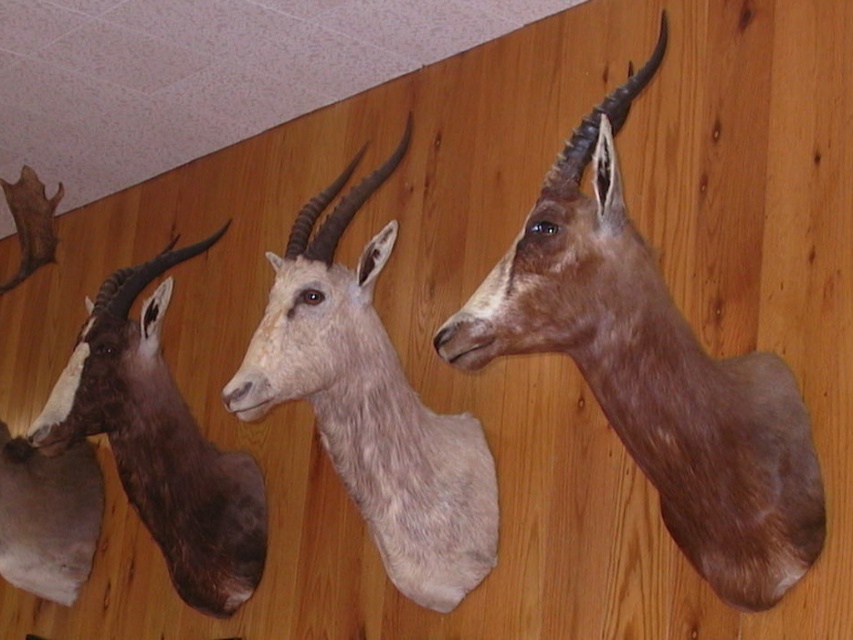
Who is more distant from viewer, (347, 209) or (264, 500)?

The point (264, 500) is behind.

Does white matte antelope head at center come in front of brown matte antelope at left?

Yes, it is in front of brown matte antelope at left.

Is point (462, 540) positioned in front of point (229, 529)?

Yes, point (462, 540) is closer to viewer.

This screenshot has width=853, height=640. I want to click on white matte antelope head at center, so click(x=370, y=403).

Between point (596, 176) and point (142, 477), which one is positioned behind?

The point (142, 477) is more distant.

Which of these two, brown matte antelope head at center or brown matte antelope at left, stands shorter?

With less height is brown matte antelope head at center.

Is point (459, 356) less distant than point (102, 413)?

That is True.

The image size is (853, 640). I want to click on brown matte antelope head at center, so click(654, 371).

How far apart are brown matte antelope head at center and white matte antelope head at center?

brown matte antelope head at center and white matte antelope head at center are 16.44 inches apart from each other.

Which is below, brown matte antelope head at center or white matte antelope head at center?

white matte antelope head at center

Identify the location of brown matte antelope head at center. (654, 371).